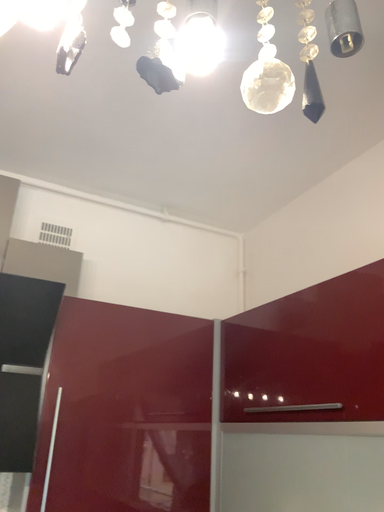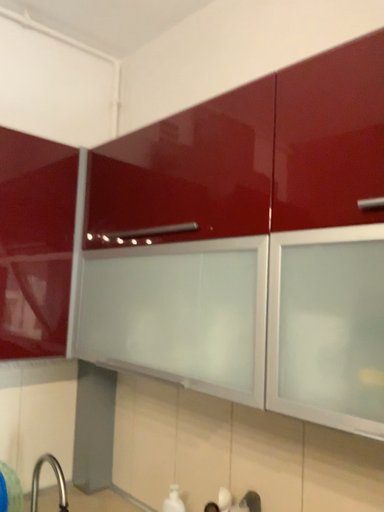
Question: Which way did the camera rotate in the video?

Choices:
 (A) rotated left
 (B) rotated right

Answer: (B)